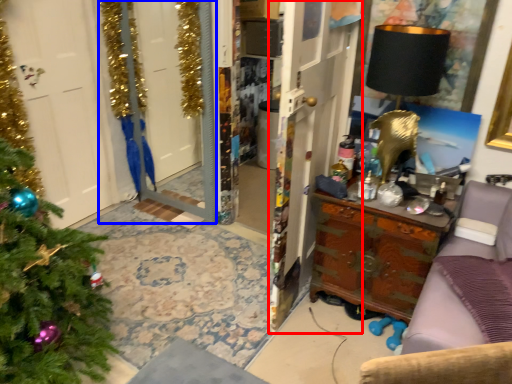
Question: Which of the following is the closest to the observer, armoire (highlighted by a red box) or screen door (highlighted by a blue box)?

Choices:
 (A) armoire
 (B) screen door

Answer: (A)